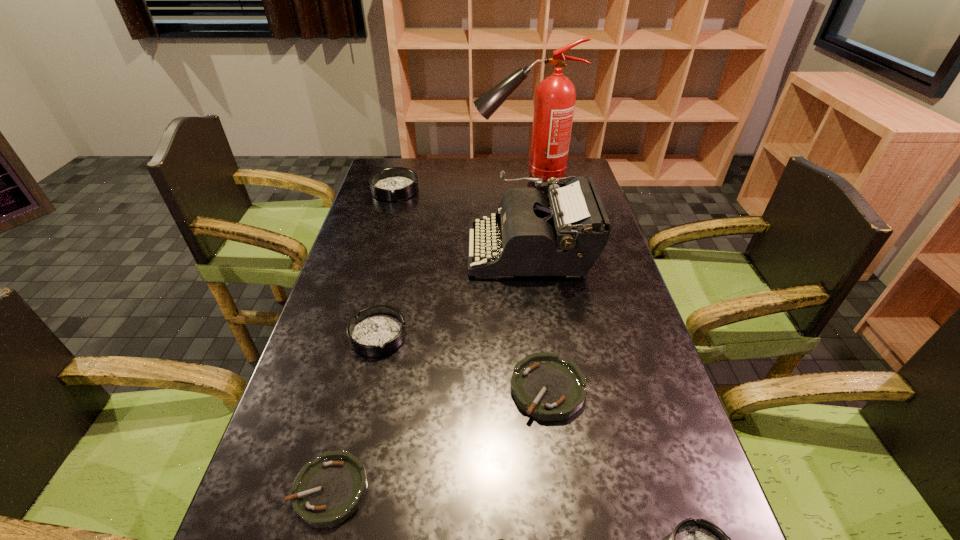
The height and width of the screenshot is (540, 960). What are the coordinates of `the tallest object` in the screenshot? It's located at (555, 96).

What are the coordinates of `fire extinguisher` in the screenshot? It's located at (555, 96).

Where is `typewriter`? The image size is (960, 540). typewriter is located at coordinates (566, 237).

You are a GUI agent. You are given a task and a screenshot of the screen. Output one action in this format:
    pyautogui.click(x=<x>, y=<y>)
    Task: Click on the second tallest object
    The image size is (960, 540).
    Given the screenshot: What is the action you would take?
    pyautogui.click(x=566, y=237)

Identify the location of the farthest dark ashtray. click(x=393, y=184).

Identify the location of the farthest ashtray. The width and height of the screenshot is (960, 540). (393, 184).

The height and width of the screenshot is (540, 960). I want to click on the second smallest dark ashtray, so click(378, 330).

Locate an element on the screen. The height and width of the screenshot is (540, 960). the second farthest dark ashtray is located at coordinates (378, 330).

Locate an element on the screen. The width and height of the screenshot is (960, 540). the biggest green ashtray is located at coordinates (544, 385).

Image resolution: width=960 pixels, height=540 pixels. I want to click on the third farthest ashtray, so click(x=544, y=385).